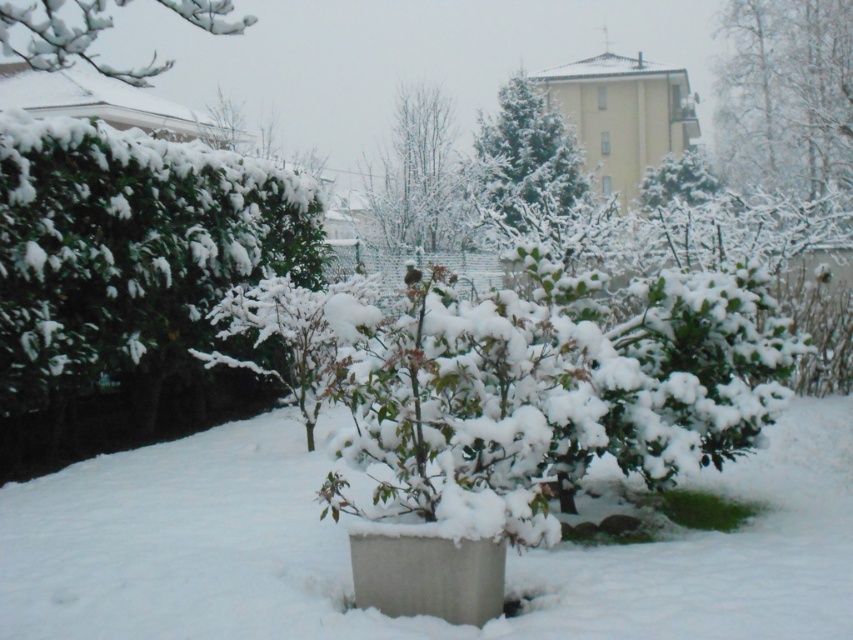
You are standing in the winter scene and want to take a photo of the green matte tree at upper center. However, the white matte snow at center is blocking your view. Can you move the snow to get a clear shot?

The white matte snow at center is in front of the green matte tree at upper center, so moving the snow would allow you to see the tree clearly.